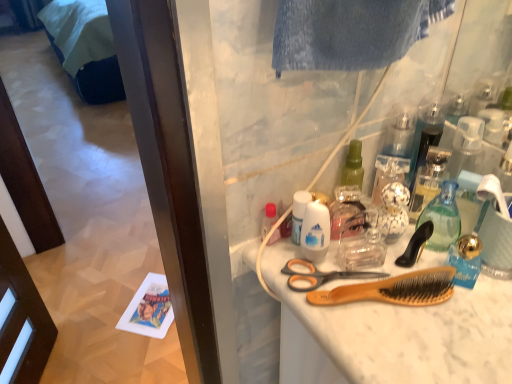
Question: Is black plastic brush at upper right, the 1th brush positioned from the top, positioned in front of wooden bristle brush at center, arranged as the 1th brush when ordered from the bottom?

Choices:
 (A) yes
 (B) no

Answer: (B)

Question: Can you confirm if black plastic brush at upper right, the 1th brush positioned from the top, is positioned to the right of wooden bristle brush at center, which is the second brush from top to bottom?

Choices:
 (A) yes
 (B) no

Answer: (A)

Question: Is black plastic brush at upper right, which appears as the second brush when ordered from the bottom, bigger than wooden bristle brush at center, which is the second brush from top to bottom?

Choices:
 (A) no
 (B) yes

Answer: (A)

Question: Does black plastic brush at upper right, which appears as the second brush when ordered from the bottom, have a greater height compared to wooden bristle brush at center, arranged as the 1th brush when ordered from the bottom?

Choices:
 (A) yes
 (B) no

Answer: (A)

Question: Is the depth of black plastic brush at upper right, the 1th brush positioned from the top, greater than that of wooden bristle brush at center, arranged as the 1th brush when ordered from the bottom?

Choices:
 (A) no
 (B) yes

Answer: (B)

Question: Is black plastic brush at upper right, the 1th brush positioned from the top, touching wooden bristle brush at center, which is the second brush from top to bottom?

Choices:
 (A) yes
 (B) no

Answer: (A)

Question: Does orange plastic scissors at center have a larger size compared to transparent plastic bottle at center, the 1th cleaning product viewed from the back?

Choices:
 (A) no
 (B) yes

Answer: (A)

Question: From the image's perspective, is orange plastic scissors at center under transparent plastic bottle at center, placed as the 1th cleaning product when sorted from right to left?

Choices:
 (A) yes
 (B) no

Answer: (A)

Question: Is orange plastic scissors at center closer to camera compared to transparent plastic bottle at center, which ranks as the 2th cleaning product in left-to-right order?

Choices:
 (A) no
 (B) yes

Answer: (B)

Question: Is orange plastic scissors at center in contact with transparent plastic bottle at center, placed as the 1th cleaning product when sorted from right to left?

Choices:
 (A) yes
 (B) no

Answer: (B)

Question: Does orange plastic scissors at center have a smaller size compared to transparent plastic bottle at center, the 1th cleaning product viewed from the back?

Choices:
 (A) yes
 (B) no

Answer: (A)

Question: Does orange plastic scissors at center have a lesser height compared to transparent plastic bottle at center, placed as the 1th cleaning product when sorted from right to left?

Choices:
 (A) yes
 (B) no

Answer: (A)

Question: Is transparent plastic bottle at center, which ranks as the 2th cleaning product in left-to-right order, outside dark blue fabric bed at lower left?

Choices:
 (A) no
 (B) yes

Answer: (B)